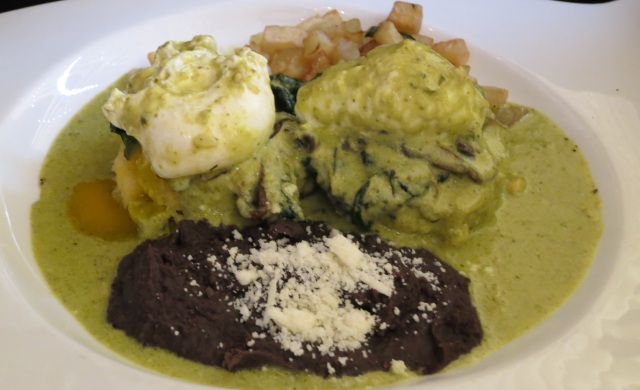
This screenshot has width=640, height=390. In order to click on inner edge of plate in this screenshot , I will do `click(589, 134)`, `click(12, 269)`.